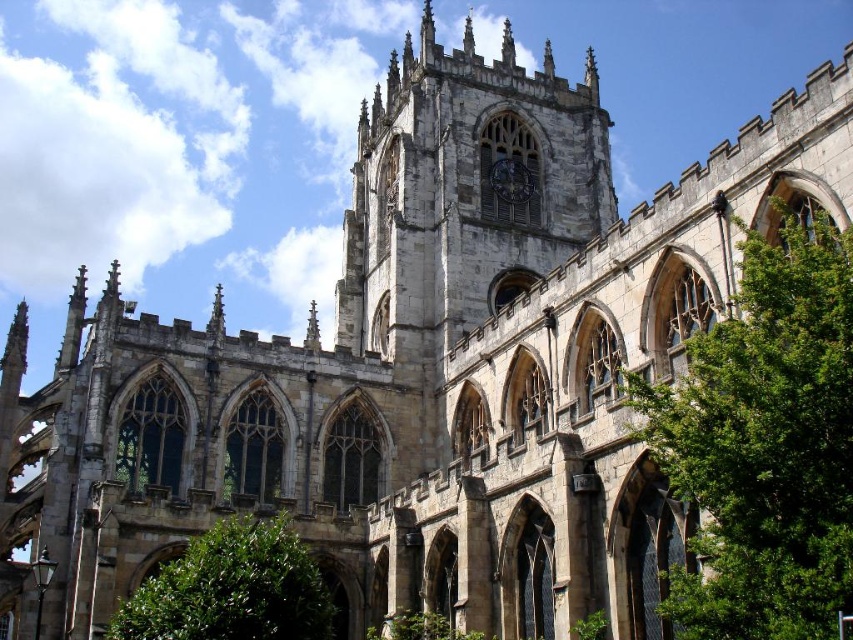
The height and width of the screenshot is (640, 853). What do you see at coordinates (764, 444) in the screenshot?
I see `green leafy tree at right` at bounding box center [764, 444].

Does green leafy tree at right have a smaller size compared to green leafy bush at lower left?

No.

The width and height of the screenshot is (853, 640). Describe the element at coordinates (764, 444) in the screenshot. I see `green leafy tree at right` at that location.

This screenshot has width=853, height=640. Find the location of `green leafy tree at right`. green leafy tree at right is located at coordinates (764, 444).

Does green leafy tree at right lie behind dark gray stone clock at center?

No, it is not.

Who is shorter, green leafy tree at right or dark gray stone clock at center?

With less height is dark gray stone clock at center.

Between point (804, 356) and point (525, 177), which one is positioned in front?

Point (804, 356)

Identify the location of green leafy tree at right. (764, 444).

Does green leafy bush at lower left come in front of dark gray stone clock at center?

Yes.

Who is lower down, green leafy bush at lower left or dark gray stone clock at center?

green leafy bush at lower left is lower down.

Who is more forward, [287,550] or [505,168]?

Point [287,550] is more forward.

At what (x,y) coordinates should I click in order to perform the action: click on green leafy bush at lower left. Please return your answer as a coordinate pair (x, y). Looking at the image, I should click on (231, 588).